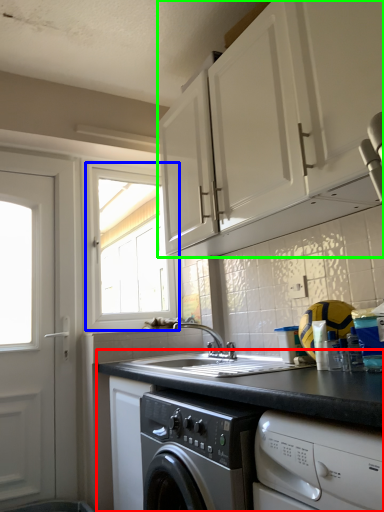
Question: Which is farther away from countertop (highlighted by a red box)? window (highlighted by a blue box) or cabinetry (highlighted by a green box)?

Choices:
 (A) window
 (B) cabinetry

Answer: (A)